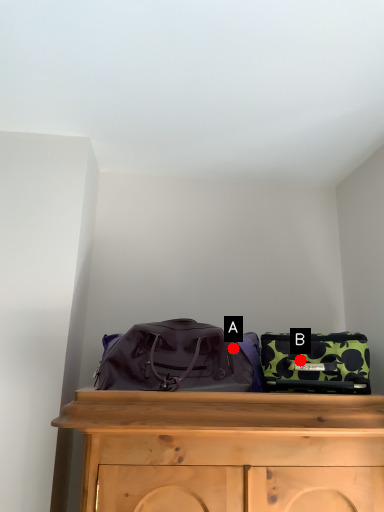
Question: Two points are circled on the image, labeled by A and B beside each circle. Which point appears farthest from the camera in this image?

Choices:
 (A) A is further
 (B) B is further

Answer: (A)